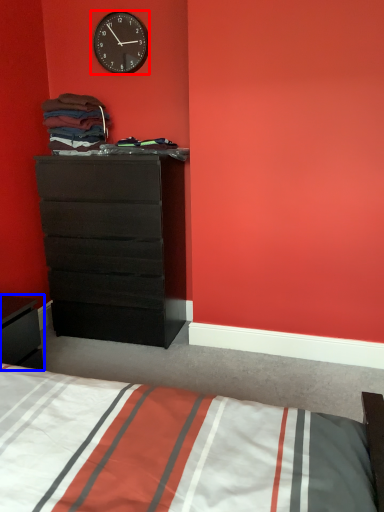
Question: Among these objects, which one is farthest to the camera, wall clock (highlighted by a red box) or nightstand (highlighted by a blue box)?

Choices:
 (A) wall clock
 (B) nightstand

Answer: (A)